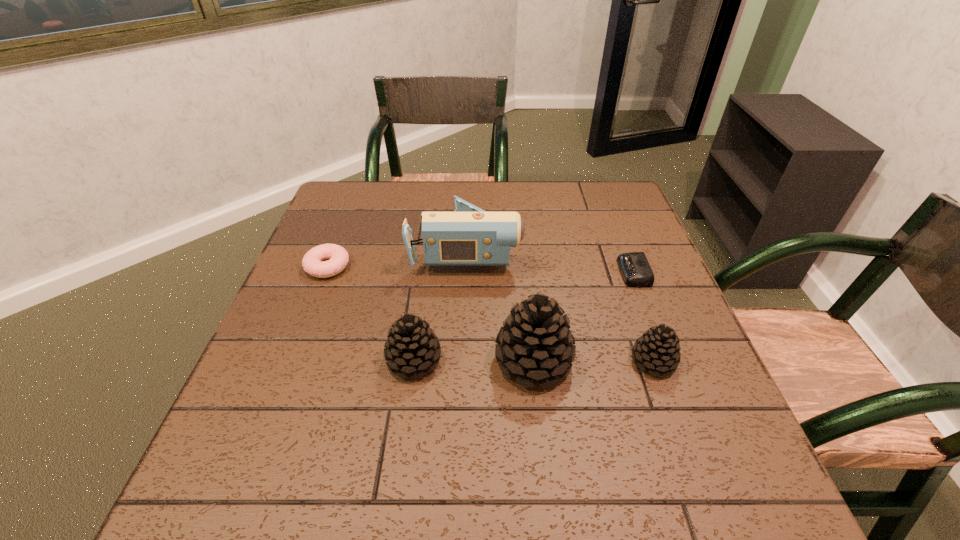
The height and width of the screenshot is (540, 960). What are the coordinates of `free space between the leftmost pinecone and the camcorder` in the screenshot? It's located at [x=440, y=305].

The width and height of the screenshot is (960, 540). What are the coordinates of `empty space that is in between the third shortest object and the tallest pinecone` in the screenshot? It's located at (593, 361).

Identify the location of free space between the third tallest object and the camcorder. This screenshot has width=960, height=540. (440, 305).

Find the location of a particular element. unoccupied position between the leftmost object and the shortest object is located at coordinates (481, 269).

Find the location of `vacant point located between the fourth tallest object and the camcorder`. vacant point located between the fourth tallest object and the camcorder is located at coordinates (560, 305).

This screenshot has height=540, width=960. Find the location of `free spot between the leftmost object and the tallest pinecone`. free spot between the leftmost object and the tallest pinecone is located at coordinates (430, 314).

Identify which object is the nearest to the camcorder. Please provide its 2D coordinates. Your answer should be formatted as a tuple, i.e. [(x, y)], where the tuple contains the x and y coordinates of a point satisfying the conditions above.

[(337, 256)]

Where is `object that is the fourth closest to the leftmost object`? object that is the fourth closest to the leftmost object is located at coordinates (657, 349).

I want to click on pinecone that is the closest to the shortest pinecone, so click(x=535, y=341).

Select which pinecone is the second closest to the tallest pinecone. Please provide its 2D coordinates. Your answer should be formatted as a tuple, i.e. [(x, y)], where the tuple contains the x and y coordinates of a point satisfying the conditions above.

[(657, 349)]